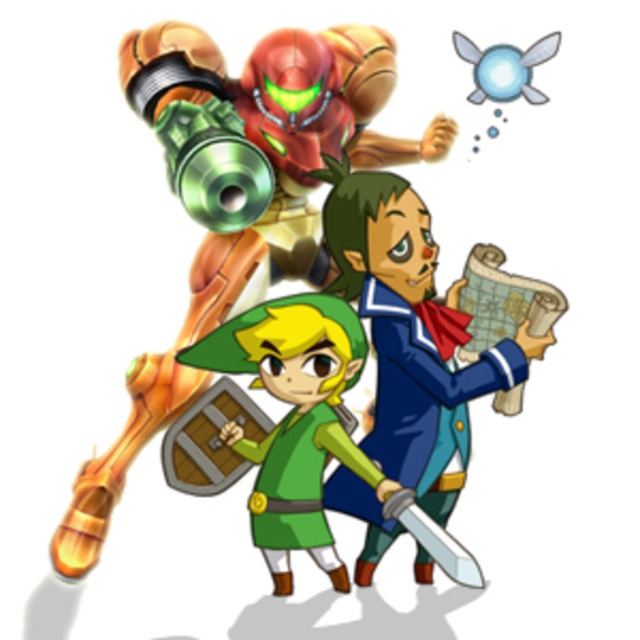
Question: Can you confirm if metallic gold suit at upper left is positioned to the left of blue fabric map at center?

Choices:
 (A) no
 (B) yes

Answer: (B)

Question: Does metallic gold suit at upper left have a greater width compared to blue fabric map at center?

Choices:
 (A) yes
 (B) no

Answer: (A)

Question: Among these objects, which one is farthest from the camera?

Choices:
 (A) blue fabric map at center
 (B) metallic gold suit at upper left

Answer: (B)

Question: Considering the relative positions of metallic gold suit at upper left and blue fabric map at center in the image provided, where is metallic gold suit at upper left located with respect to blue fabric map at center?

Choices:
 (A) right
 (B) left

Answer: (B)

Question: Which object is farther from the camera taking this photo?

Choices:
 (A) metallic gold suit at upper left
 (B) blue fabric map at center

Answer: (A)